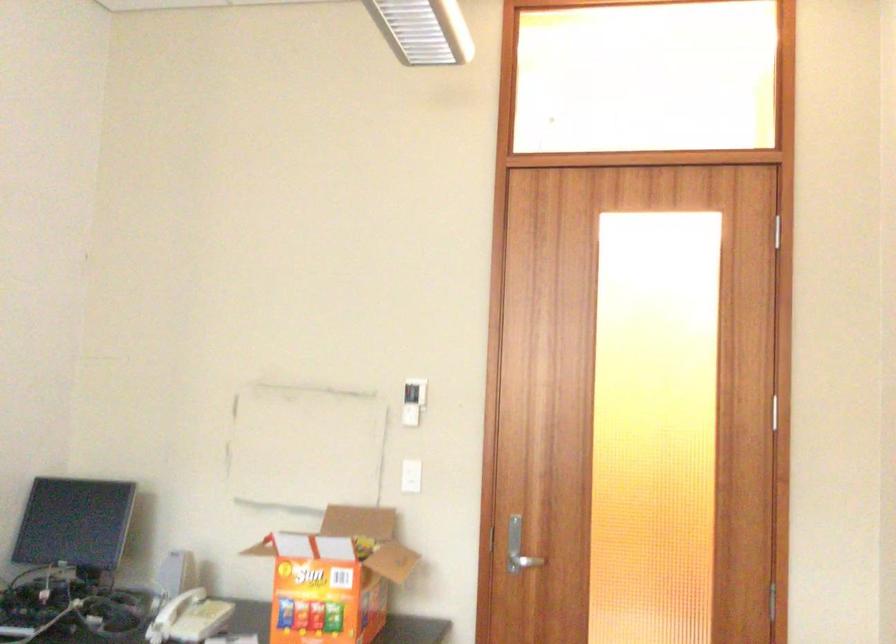
Describe the element at coordinates (170, 617) in the screenshot. The height and width of the screenshot is (644, 896). I see `the telephone handset` at that location.